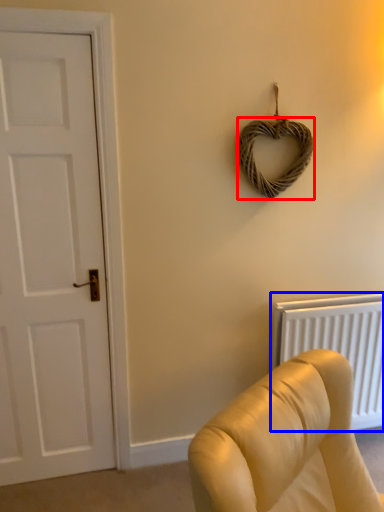
Question: Which object is further to the camera taking this photo, rope (highlighted by a red box) or radiator (highlighted by a blue box)?

Choices:
 (A) rope
 (B) radiator

Answer: (B)